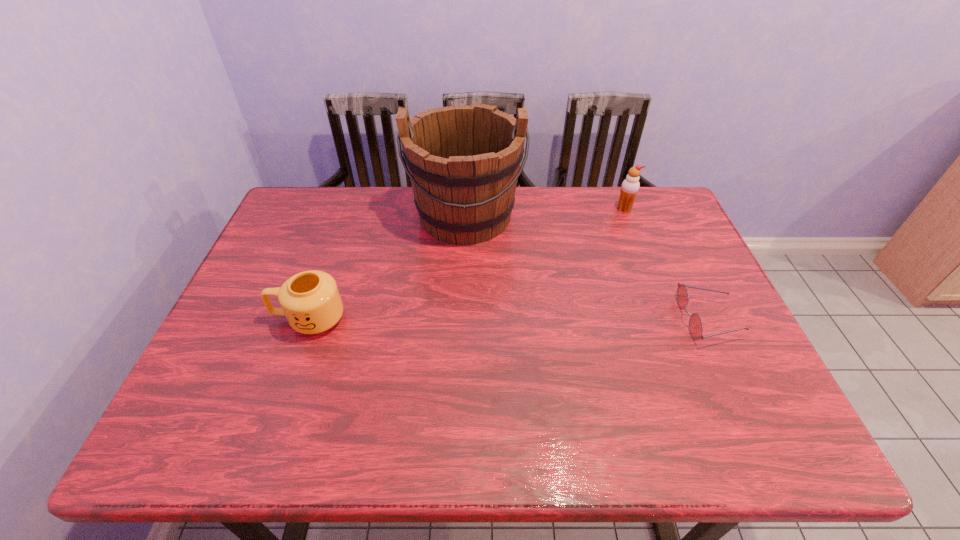
Locate an element on the screen. This screenshot has height=540, width=960. free space between the icecream and the spectacles is located at coordinates (665, 265).

Locate an element on the screen. The height and width of the screenshot is (540, 960). vacant region between the shortest object and the second tallest object is located at coordinates (665, 265).

Image resolution: width=960 pixels, height=540 pixels. Find the location of `vacant area that lies between the tallest object and the third object from left to right`. vacant area that lies between the tallest object and the third object from left to right is located at coordinates (545, 212).

What are the coordinates of `free space that is in between the third shortest object and the spectacles` in the screenshot? It's located at (665, 265).

Where is `free space between the icecream and the second shortest object`? free space between the icecream and the second shortest object is located at coordinates (467, 264).

Locate an element on the screen. Image resolution: width=960 pixels, height=540 pixels. vacant space in between the tallest object and the second tallest object is located at coordinates (545, 212).

What are the coordinates of `blank region between the third object from left to right and the third object from right to left` in the screenshot? It's located at (545, 212).

Image resolution: width=960 pixels, height=540 pixels. What are the coordinates of `object that is the nearest to the leftmost object` in the screenshot? It's located at (463, 161).

Image resolution: width=960 pixels, height=540 pixels. I want to click on object that is the third closest to the icecream, so click(310, 300).

Where is `free space that satisfies the following two spatial constraints: 1. on the back side of the second tallest object; 2. on the right side of the tallest object`? The height and width of the screenshot is (540, 960). free space that satisfies the following two spatial constraints: 1. on the back side of the second tallest object; 2. on the right side of the tallest object is located at coordinates (467, 209).